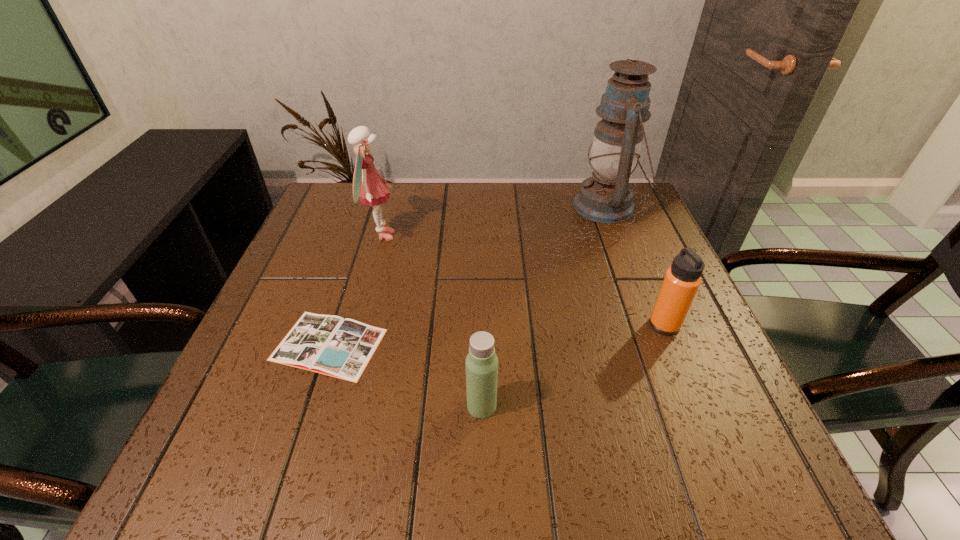
Where is `free location at the near edge`? The width and height of the screenshot is (960, 540). free location at the near edge is located at coordinates (646, 487).

Locate an element on the screen. The width and height of the screenshot is (960, 540). vacant space at the left edge is located at coordinates [x=322, y=252].

Where is `free space at the right edge of the desktop`? The image size is (960, 540). free space at the right edge of the desktop is located at coordinates (611, 257).

In the image, there is a desktop. Where is `vacant space at the near left corner`? The image size is (960, 540). vacant space at the near left corner is located at coordinates (238, 432).

You are a GUI agent. You are given a task and a screenshot of the screen. Output one action in this format:
    pyautogui.click(x=<x>, y=<y>)
    Task: Click on the free point between the book and the tallest object
    The height and width of the screenshot is (540, 960).
    Given the screenshot: What is the action you would take?
    pyautogui.click(x=468, y=275)

Image resolution: width=960 pixels, height=540 pixels. Find the location of `free area in between the tallest object and the doll`. free area in between the tallest object and the doll is located at coordinates (493, 221).

This screenshot has height=540, width=960. What are the coordinates of `free spot between the tallest object and the farther thermos bottle` in the screenshot? It's located at (636, 266).

Find the location of a particular element. This screenshot has width=960, height=540. free spot between the right thermos bottle and the tallest object is located at coordinates (636, 266).

This screenshot has height=540, width=960. What are the coordinates of `free space between the second tallest object and the farther thermos bottle` in the screenshot? It's located at (522, 280).

Where is `free space between the shortest object and the second tallest object`? free space between the shortest object and the second tallest object is located at coordinates (355, 290).